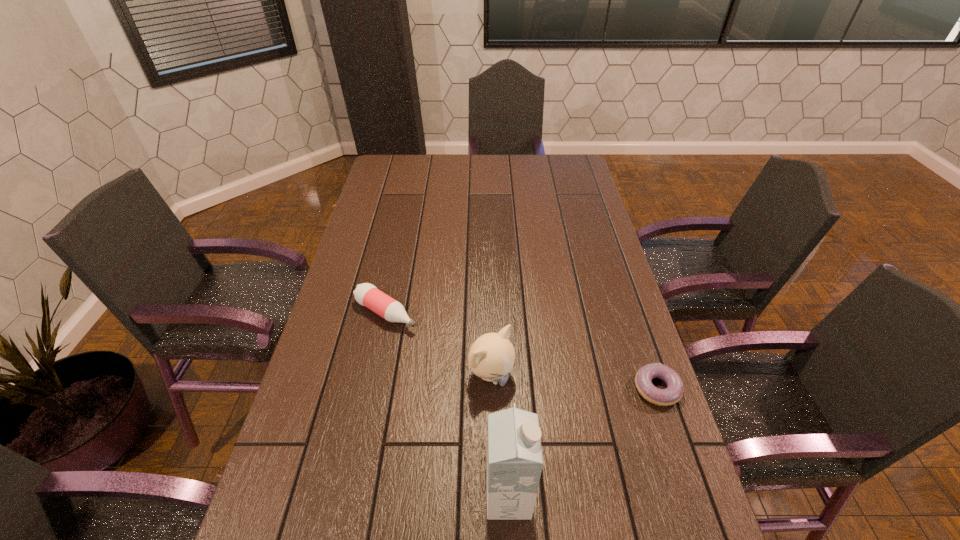
You are a GUI agent. You are given a task and a screenshot of the screen. Output one action in this format:
    pyautogui.click(x=<x>, y=<y>)
    Task: Click on the free space at the left edge
    Image resolution: width=960 pixels, height=540 pixels.
    Given the screenshot: What is the action you would take?
    pyautogui.click(x=353, y=324)

Where is `vacant space at the right edge`? The image size is (960, 540). vacant space at the right edge is located at coordinates (592, 389).

This screenshot has height=540, width=960. Identify the location of free space between the shortest object and the carton. (583, 442).

This screenshot has height=540, width=960. What are the coordinates of `vacant point located between the tallest object and the leftmost object` in the screenshot? It's located at (447, 405).

Find the location of a particular element. free spot between the third tallest object and the doughnut is located at coordinates (521, 350).

In order to click on free spot between the farthest object and the kitten in this screenshot , I will do `click(439, 344)`.

At what (x,y) coordinates should I click in order to perform the action: click on empty space that is in between the third shortest object and the rightmost object. Please return your answer as a coordinate pair (x, y). This screenshot has height=540, width=960. Looking at the image, I should click on (574, 382).

The width and height of the screenshot is (960, 540). In order to click on free spot between the farthest object and the nearest object in this screenshot , I will do `click(447, 405)`.

Identify the location of vacant space that's between the kitten and the leftmost object. The width and height of the screenshot is (960, 540). (439, 344).

Find the location of a particular element. The height and width of the screenshot is (540, 960). vacant area that lies between the kitten and the leftmost object is located at coordinates (439, 344).